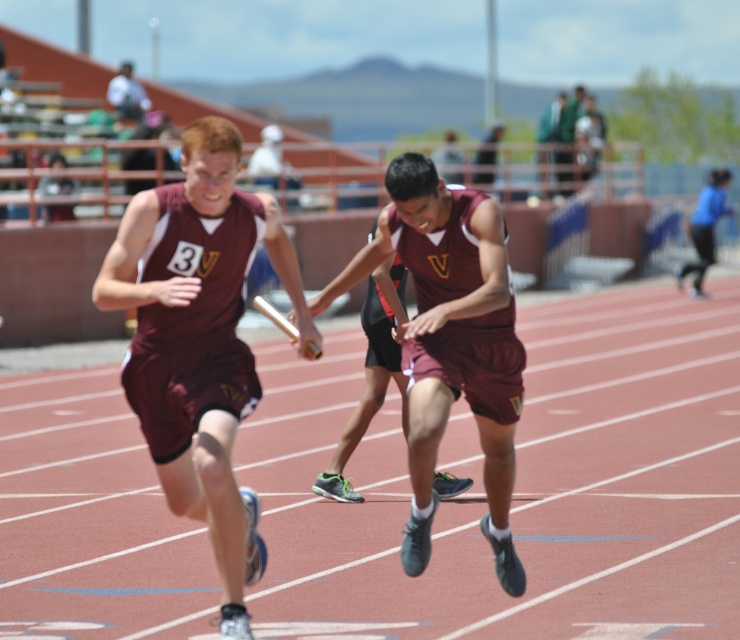
Question: Does maroon jersey at center have a smaller size compared to blue fabric runner at right?

Choices:
 (A) yes
 (B) no

Answer: (A)

Question: Does maroon jersey at center appear on the left side of blue fabric runner at right?

Choices:
 (A) no
 (B) yes

Answer: (B)

Question: Among these points, which one is nearest to the camera?

Choices:
 (A) (687, 227)
 (B) (229, 484)

Answer: (B)

Question: Among these objects, which one is nearest to the camera?

Choices:
 (A) maroon fabric uniform at center
 (B) blue fabric runner at right

Answer: (A)

Question: Is maroon jersey at center below blue fabric runner at right?

Choices:
 (A) yes
 (B) no

Answer: (A)

Question: Which point appears farthest from the camera in this image?

Choices:
 (A) (719, 196)
 (B) (420, 337)

Answer: (A)